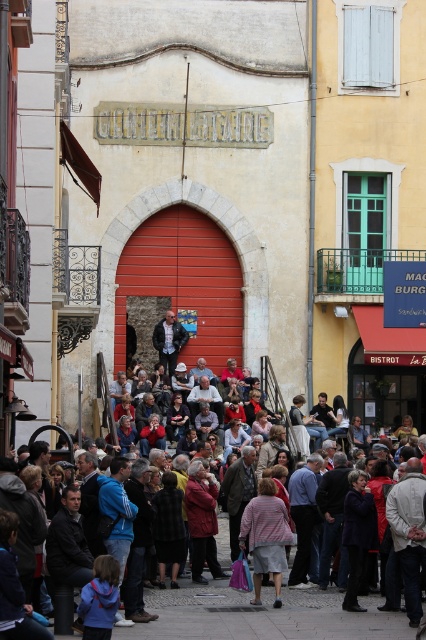
Is point (287, 589) positioned after point (60, 621)?

That is True.

Is multicolored clothing at center below dark gray jacket at lower left?

Yes.

What are the coordinates of `multicolored clothing at center` in the screenshot? It's located at (261, 616).

Based on the photo, is dark gray jacket at lower left positioned at the back of red wool coat at center?

No.

Can you confirm if dark gray jacket at lower left is positioned above red wool coat at center?

Yes, dark gray jacket at lower left is above red wool coat at center.

Where is `dark gray jacket at lower left`? The image size is (426, 640). dark gray jacket at lower left is located at coordinates (66, 556).

Which is more to the right, multicolored clothing at center or dark blue fabric coat at center?

Positioned to the right is dark blue fabric coat at center.

Is point (222, 525) farther from viewer compared to point (347, 604)?

Yes, it is behind point (347, 604).

Is point (154, 628) behind point (367, 502)?

That is False.

Image resolution: width=426 pixels, height=640 pixels. I want to click on multicolored clothing at center, so click(x=261, y=616).